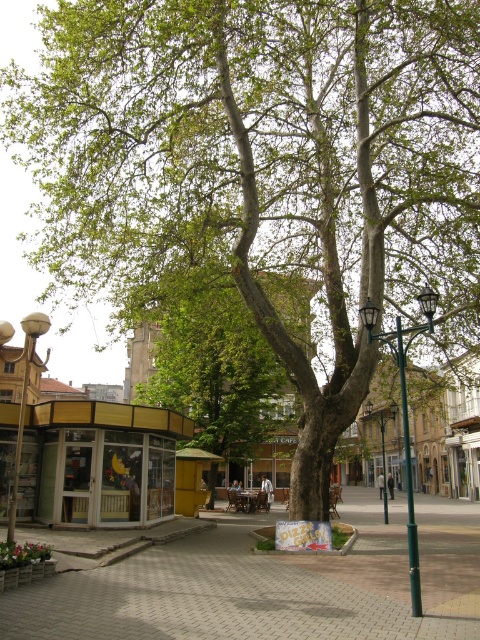
Question: Which point is farther to the camera?

Choices:
 (A) (393, 336)
 (B) (16, 493)
 (C) (395, 419)
 (D) (235, 572)

Answer: (C)

Question: Can you confirm if green leafy tree at center is positioned above green metal streetlight at center?

Choices:
 (A) yes
 (B) no

Answer: (A)

Question: Does green leafy tree at center lie in front of matte white lamp post at left?

Choices:
 (A) yes
 (B) no

Answer: (B)

Question: Which object appears farthest from the camera in this image?

Choices:
 (A) matte white lamp post at left
 (B) green metal streetlight at center
 (C) paved brick pavement at center

Answer: (B)

Question: Can you confirm if paved brick pavement at center is bigger than green leafy tree at center?

Choices:
 (A) no
 (B) yes

Answer: (A)

Question: Estimate the real-world distances between objects in this image. Which object is farther from the green leafy tree at center?

Choices:
 (A) matte white lamp post at left
 (B) yellow glass kiosk at center
 (C) green metal streetlight at center
 (D) paved brick pavement at center

Answer: (D)